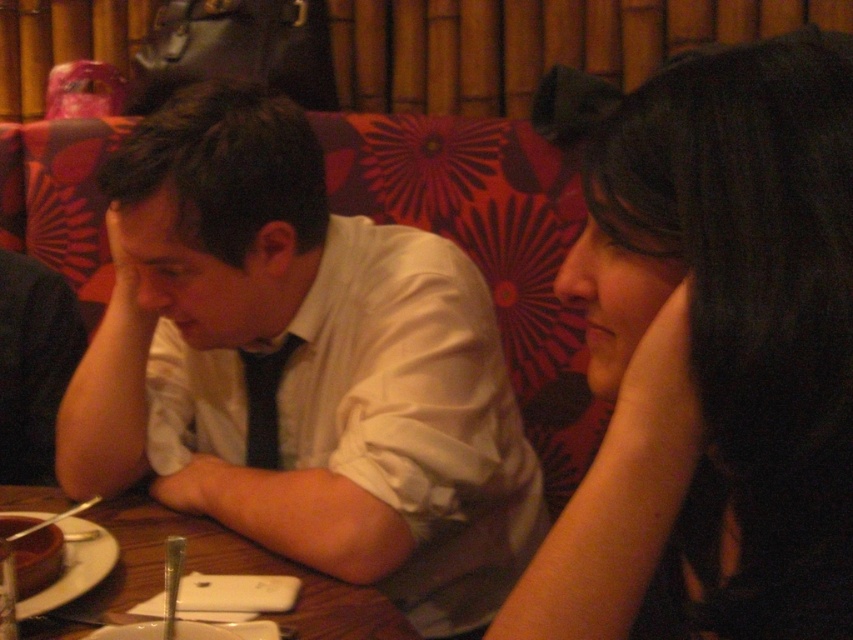
You are a photographer setting up a shoot in this restaurant scene. You need to position a spotlight directly above the white satin shirt at center. Given the coordinates from the scene description, where should you aim the spotlight?

The white satin shirt at center is located at point (300, 369), so you should aim the spotlight at those coordinates to illuminate it directly.

You are a photographer trying to capture the man in the white satin shirt at center. The camera is positioned at the origin point. The coordinates of the man are marked as point (300, 369). To ensure the man is the main focus, should you adjust the camera to pan left or right? Please explain your reasoning based on the coordinates provided.

The coordinates of the man in the white satin shirt at center are point (300, 369). Since the origin point is at the center of the frame, a positive x value indicates the right side. Therefore, the man is positioned to the right of the center. To center him, you should pan the camera slightly to the left to bring him into the frame center.

You are a photographer standing in front of the scene. You want to take a photo focusing on the black hair at upper right and the wooden table at center. Which object should you adjust your camera focus to first to ensure both are in the frame?

The black hair at upper right is closer to the viewer than the wooden table at center. To ensure both are in focus, adjust the camera focus starting with the black hair at upper right first, then the wooden table at center.